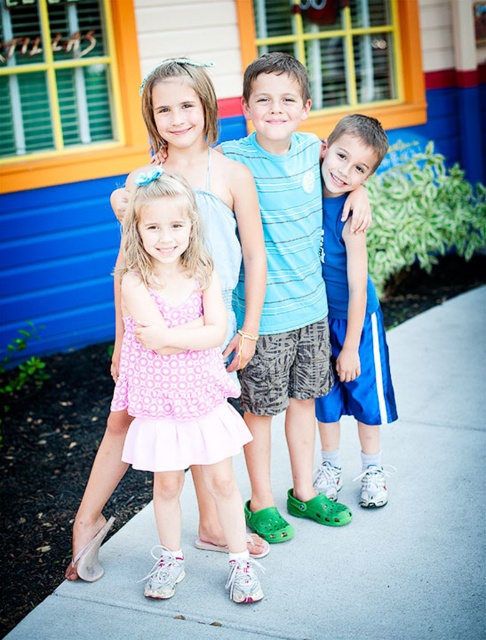
Describe the element at coordinates (336, 529) in the screenshot. I see `gray concrete pavement at center` at that location.

Who is more forward, [296,624] or [172,336]?

Positioned in front is point [172,336].

What do you see at coordinates (336, 529) in the screenshot? Image resolution: width=486 pixels, height=640 pixels. I see `gray concrete pavement at center` at bounding box center [336, 529].

You are a GUI agent. You are given a task and a screenshot of the screen. Output one action in this format:
    pyautogui.click(x=<x>, y=<y>)
    Task: Click on the gray concrete pavement at center
    This screenshot has height=640, width=486.
    Given the screenshot: What is the action you would take?
    pyautogui.click(x=336, y=529)

In the scene shown: Does pink satin dress at center come in front of blue athletic shorts at center?

Yes, it is.

Does point (229, 548) lie in front of point (331, 211)?

Yes, it is in front of point (331, 211).

I want to click on pink satin dress at center, so click(x=177, y=376).

Is gray concrete pavement at center thinner than blue athletic shorts at center?

No, gray concrete pavement at center is not thinner than blue athletic shorts at center.

Does point (36, 627) come behind point (381, 492)?

That is False.

Is point (312, 582) farther from camera compared to point (340, 298)?

That is False.

This screenshot has height=640, width=486. Identify the location of gray concrete pavement at center. (336, 529).